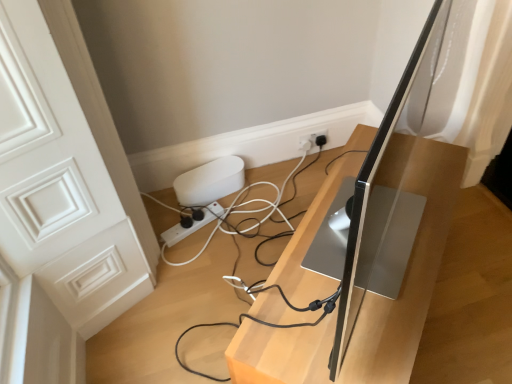
Find the location of a particular element. The image size is (512, 384). vacant space situated on the left part of white plastic power strip at lower center is located at coordinates (165, 226).